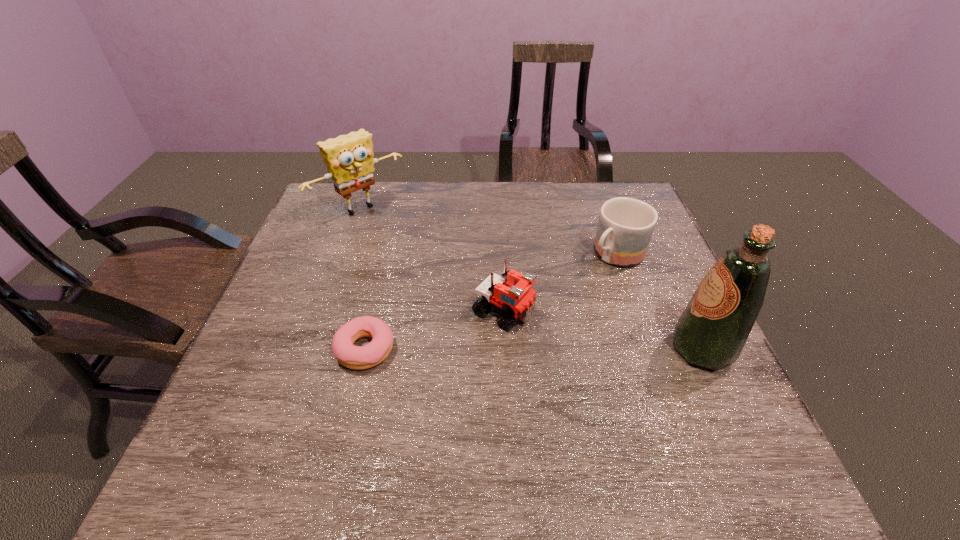
Where is `free spot on the desktop that is between the shortest object and the olive oil and is positioned on the face of the farthest object`? This screenshot has height=540, width=960. free spot on the desktop that is between the shortest object and the olive oil and is positioned on the face of the farthest object is located at coordinates coord(512,349).

Identify the location of vacant spot on the desktop that is between the doughnut and the olive oil and is positioned on the side with the handle of the second farthest object. Image resolution: width=960 pixels, height=540 pixels. (506, 349).

At what (x,y) coordinates should I click in order to perform the action: click on vacant spot on the desktop that is between the shortest object and the tallest object and is positioned on the front-facing side of the third object from left to right. Please return your answer as a coordinate pair (x, y). The image size is (960, 540). Looking at the image, I should click on (578, 349).